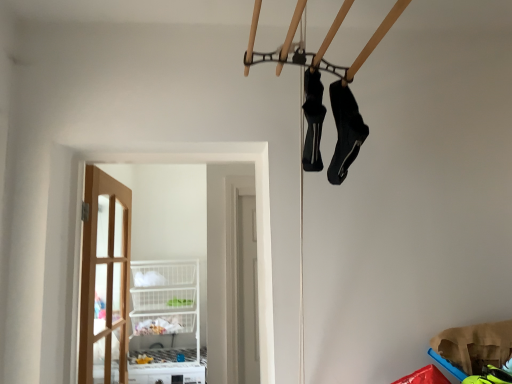
Question: From the image's perspective, is clear glass door at center located above or below black synthetic socks at upper right, arranged as the second footwear when viewed from the left?

Choices:
 (A) below
 (B) above

Answer: (A)

Question: Is clear glass door at center in front of or behind black synthetic socks at upper right, which is the 1th footwear from right to left, in the image?

Choices:
 (A) behind
 (B) front

Answer: (A)

Question: Based on their relative distances, which object is farther from the clear glass door at center?

Choices:
 (A) black synthetic socks at upper right, arranged as the second footwear when viewed from the left
 (B) black matte shoe at center, acting as the 1th footwear starting from the left
 (C) wooden door at left

Answer: (C)

Question: Which of these objects is positioned closest to the black synthetic socks at upper right, arranged as the second footwear when viewed from the left?

Choices:
 (A) black matte shoe at center, acting as the 1th footwear starting from the left
 (B) clear glass door at center
 (C) wooden door at left

Answer: (A)